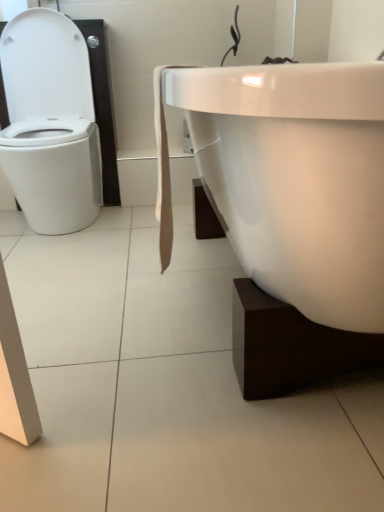
Question: Can you confirm if white glossy toilet at left is bigger than white glossy bathtub at right?

Choices:
 (A) no
 (B) yes

Answer: (A)

Question: Is white glossy bathtub at right located within white glossy toilet at left?

Choices:
 (A) no
 (B) yes

Answer: (A)

Question: Can you confirm if white glossy toilet at left is shorter than white glossy bathtub at right?

Choices:
 (A) yes
 (B) no

Answer: (B)

Question: Is white glossy toilet at left wider than white glossy bathtub at right?

Choices:
 (A) yes
 (B) no

Answer: (B)

Question: Is white glossy toilet at left at the right side of white glossy bathtub at right?

Choices:
 (A) yes
 (B) no

Answer: (B)

Question: Is white glossy toilet at left looking in the opposite direction of white glossy bathtub at right?

Choices:
 (A) yes
 (B) no

Answer: (B)

Question: From a real-world perspective, is white glossy bathtub at right located beneath white glossy toilet at left?

Choices:
 (A) yes
 (B) no

Answer: (A)

Question: Is white glossy bathtub at right closer to camera compared to white glossy toilet at left?

Choices:
 (A) yes
 (B) no

Answer: (A)

Question: Does white glossy bathtub at right have a greater height compared to white glossy toilet at left?

Choices:
 (A) yes
 (B) no

Answer: (B)

Question: Is white glossy bathtub at right shorter than white glossy toilet at left?

Choices:
 (A) yes
 (B) no

Answer: (A)

Question: Is white glossy bathtub at right thinner than white glossy toilet at left?

Choices:
 (A) yes
 (B) no

Answer: (B)

Question: Does white glossy bathtub at right contain white glossy toilet at left?

Choices:
 (A) yes
 (B) no

Answer: (B)

Question: In terms of width, does white glossy bathtub at right look wider or thinner when compared to white glossy toilet at left?

Choices:
 (A) thin
 (B) wide

Answer: (B)